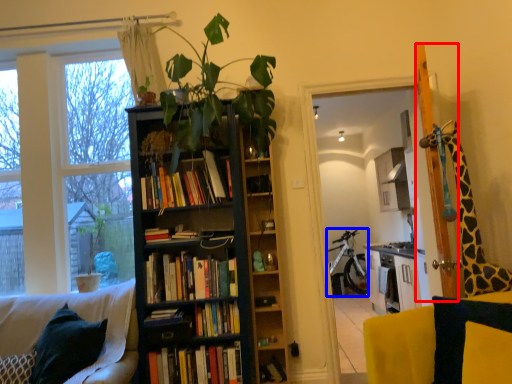
Question: Which of the following is the farthest to the observer, screen door (highlighted by a red box) or bicycle (highlighted by a blue box)?

Choices:
 (A) screen door
 (B) bicycle

Answer: (B)